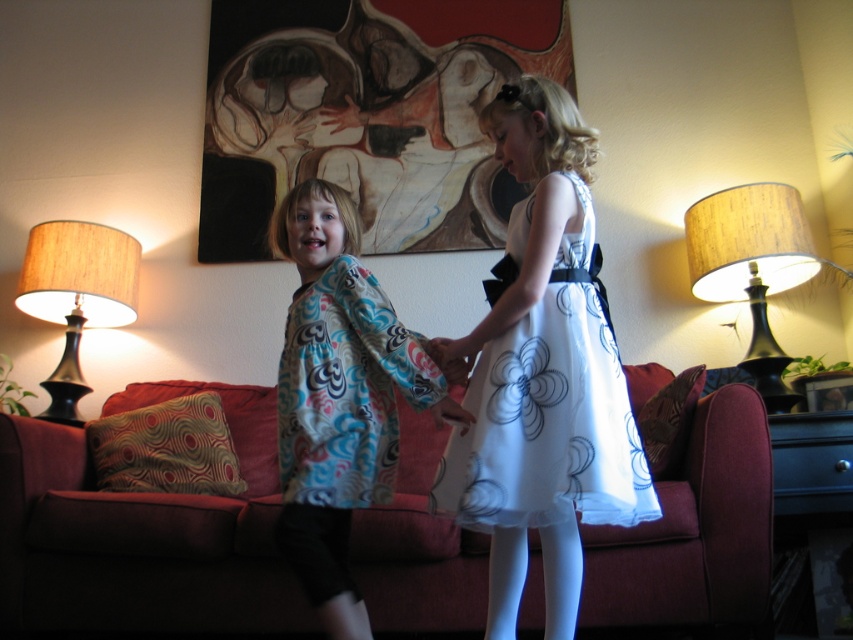
Can you confirm if velvet red couch at center is smaller than matte floral kimono at center?

Actually, velvet red couch at center might be larger than matte floral kimono at center.

Is point (62, 634) farther from viewer compared to point (346, 595)?

Yes, point (62, 634) is farther from viewer.

At what (x,y) coordinates should I click in order to perform the action: click on velvet red couch at center. Please return your answer as a coordinate pair (x, y). Looking at the image, I should click on (131, 552).

Who is positioned more to the right, white satin dress at center or black wood lampshade at right?

Positioned to the right is black wood lampshade at right.

Does point (463, 454) come closer to viewer compared to point (788, 269)?

Yes.

Image resolution: width=853 pixels, height=640 pixels. What are the coordinates of `white satin dress at center` in the screenshot? It's located at (549, 413).

Does matte black lampshade at left have a lesser height compared to matte fabric hand at center?

In fact, matte black lampshade at left may be taller than matte fabric hand at center.

Based on the photo, is matte black lampshade at left to the left of matte fabric hand at center from the viewer's perspective?

Indeed, matte black lampshade at left is positioned on the left side of matte fabric hand at center.

Locate an element on the screen. matte black lampshade at left is located at coordinates (76, 296).